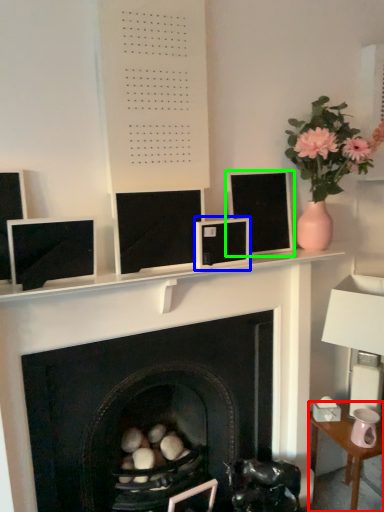
Question: Estimate the real-world distances between objects in this image. Which object is closer to table (highlighted by a red box), computer monitor (highlighted by a blue box) or computer monitor (highlighted by a green box)?

Choices:
 (A) computer monitor
 (B) computer monitor

Answer: (B)